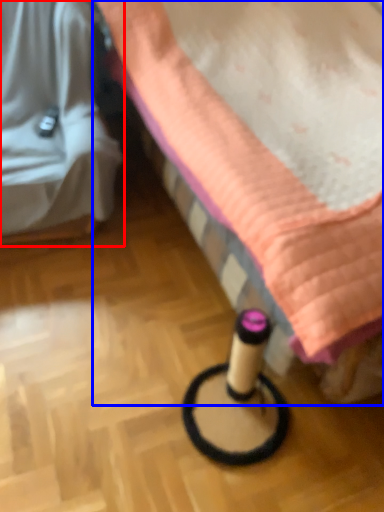
Question: Which point is further to the camera, furniture (highlighted by a red box) or furniture (highlighted by a blue box)?

Choices:
 (A) furniture
 (B) furniture

Answer: (A)